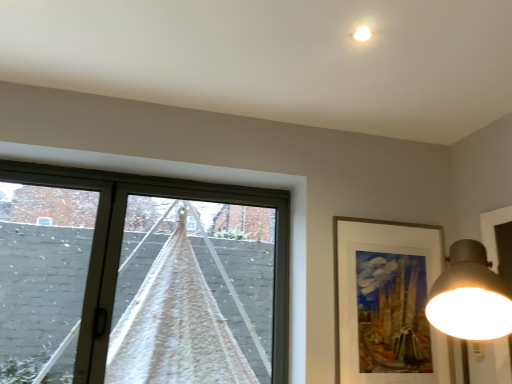
Question: From the image's perspective, is gold-framed artwork at upper right on white textured curtain at left?

Choices:
 (A) no
 (B) yes

Answer: (A)

Question: Is there a large distance between gold-framed artwork at upper right and white textured curtain at left?

Choices:
 (A) no
 (B) yes

Answer: (A)

Question: Would you say gold-framed artwork at upper right is outside white textured curtain at left?

Choices:
 (A) yes
 (B) no

Answer: (A)

Question: Considering the relative sizes of gold-framed artwork at upper right and white textured curtain at left in the image provided, is gold-framed artwork at upper right bigger than white textured curtain at left?

Choices:
 (A) no
 (B) yes

Answer: (A)

Question: Is gold-framed artwork at upper right shorter than white textured curtain at left?

Choices:
 (A) yes
 (B) no

Answer: (A)

Question: Is gold-framed artwork at upper right further to the viewer compared to white textured curtain at left?

Choices:
 (A) no
 (B) yes

Answer: (B)

Question: From the image's perspective, would you say white textured curtain at left is shown under gold-framed artwork at upper right?

Choices:
 (A) no
 (B) yes

Answer: (A)

Question: Is white textured curtain at left oriented towards gold-framed artwork at upper right?

Choices:
 (A) no
 (B) yes

Answer: (A)

Question: Can you confirm if white textured curtain at left is wider than gold-framed artwork at upper right?

Choices:
 (A) no
 (B) yes

Answer: (B)

Question: Is white textured curtain at left turned away from gold-framed artwork at upper right?

Choices:
 (A) no
 (B) yes

Answer: (A)

Question: From a real-world perspective, is white textured curtain at left over gold-framed artwork at upper right?

Choices:
 (A) yes
 (B) no

Answer: (A)

Question: Is white textured curtain at left not inside gold-framed artwork at upper right?

Choices:
 (A) no
 (B) yes

Answer: (B)

Question: Is point [366, 294] closer or farther from the camera than point [192, 331]?

Choices:
 (A) farther
 (B) closer

Answer: (B)